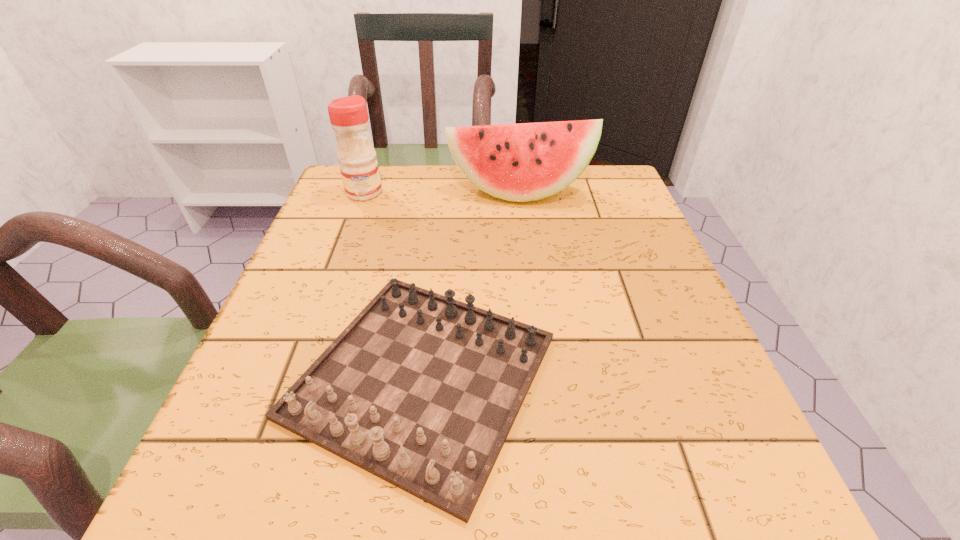
Where is `condiment`? This screenshot has height=540, width=960. condiment is located at coordinates (349, 118).

At what (x,y) coordinates should I click in order to perform the action: click on watermelon. Please return your answer as a coordinate pair (x, y). Image resolution: width=960 pixels, height=540 pixels. Looking at the image, I should click on (523, 162).

Image resolution: width=960 pixels, height=540 pixels. I want to click on chessboard, so click(x=421, y=390).

This screenshot has height=540, width=960. I want to click on the nearest object, so click(421, 390).

The height and width of the screenshot is (540, 960). I want to click on vacant space positioned 0.050m on the back of the tallest object, so click(372, 173).

This screenshot has height=540, width=960. I want to click on vacant space located on the outer rind of the watermelon, so click(521, 220).

Locate an element on the screen. vacant space located on the back of the nearest object is located at coordinates (439, 227).

The image size is (960, 540). What are the coordinates of `condiment present at the far edge` in the screenshot? It's located at (349, 118).

The width and height of the screenshot is (960, 540). I want to click on watermelon that is at the far edge, so 523,162.

At what (x,y) coordinates should I click in order to perform the action: click on object positioned at the near edge. Please return your answer as a coordinate pair (x, y). Image resolution: width=960 pixels, height=540 pixels. Looking at the image, I should click on (421, 390).